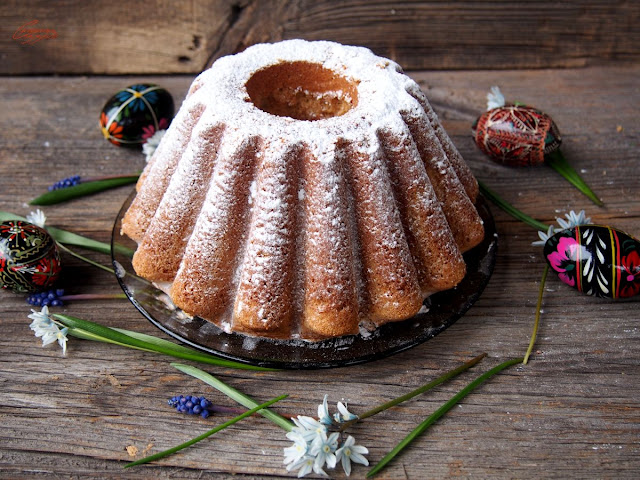
Where is `glass cake plate`? The height and width of the screenshot is (480, 640). glass cake plate is located at coordinates (244, 354).